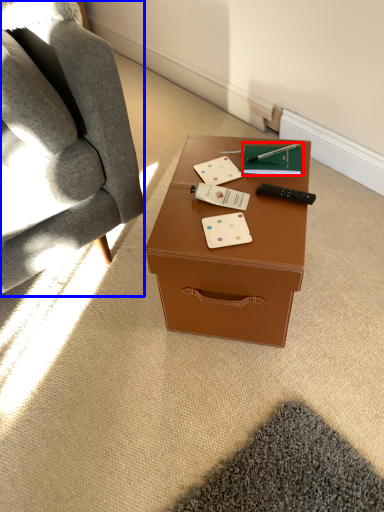
Question: Which object appears farthest to the camera in this image, notebook (highlighted by a red box) or chair (highlighted by a blue box)?

Choices:
 (A) notebook
 (B) chair

Answer: (A)